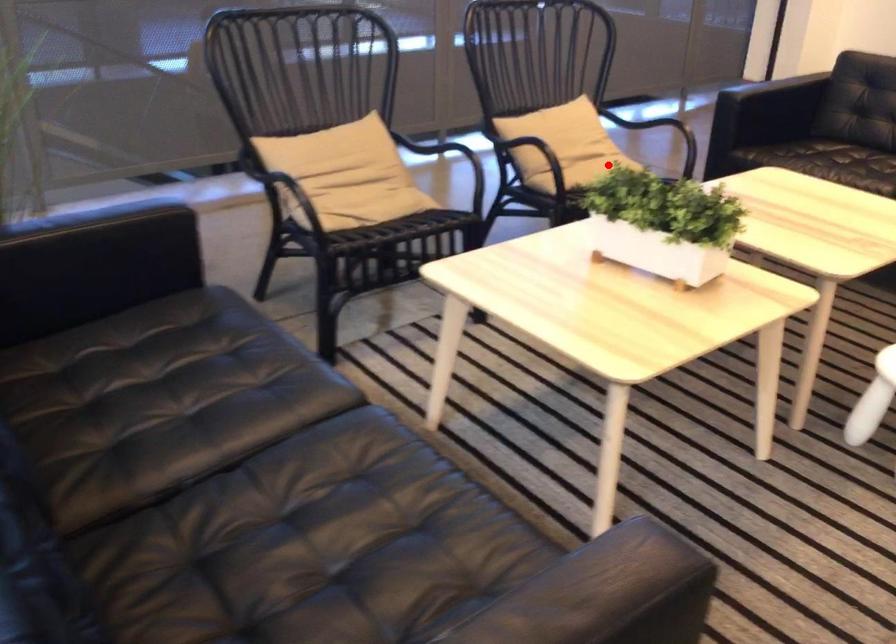
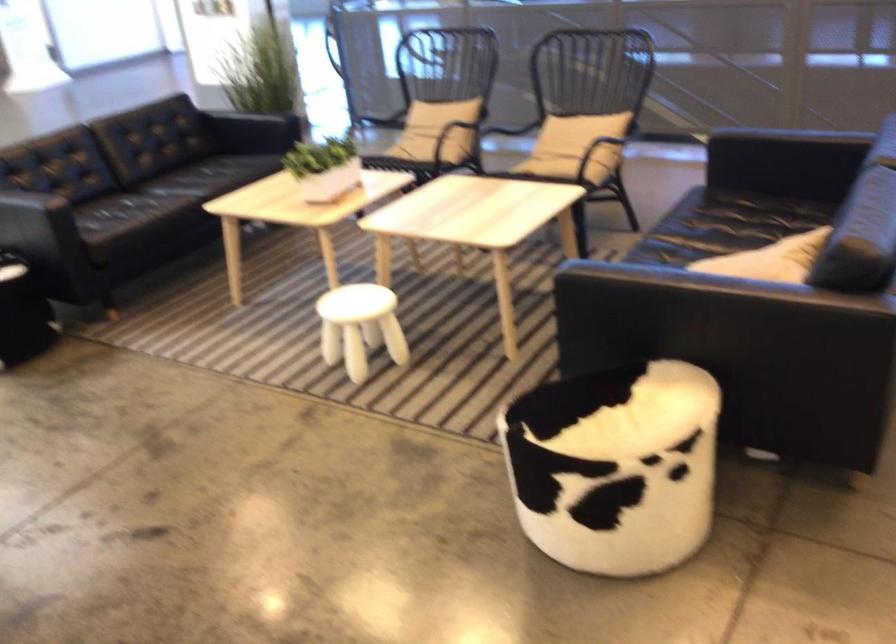
Question: I am providing you with two images of the same scene from different viewpoints. A red point is shown in image1. For the corresponding object point in image2, is it positioned nearer or farther from the camera?

Choices:
 (A) Nearer
 (B) Farther

Answer: (B)